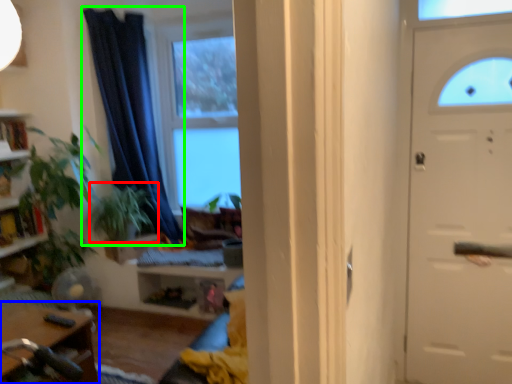
Question: Which object is positioned closest to plant (highlighted by a red box)? Select from table (highlighted by a blue box) and curtain (highlighted by a green box).

Choices:
 (A) table
 (B) curtain

Answer: (B)